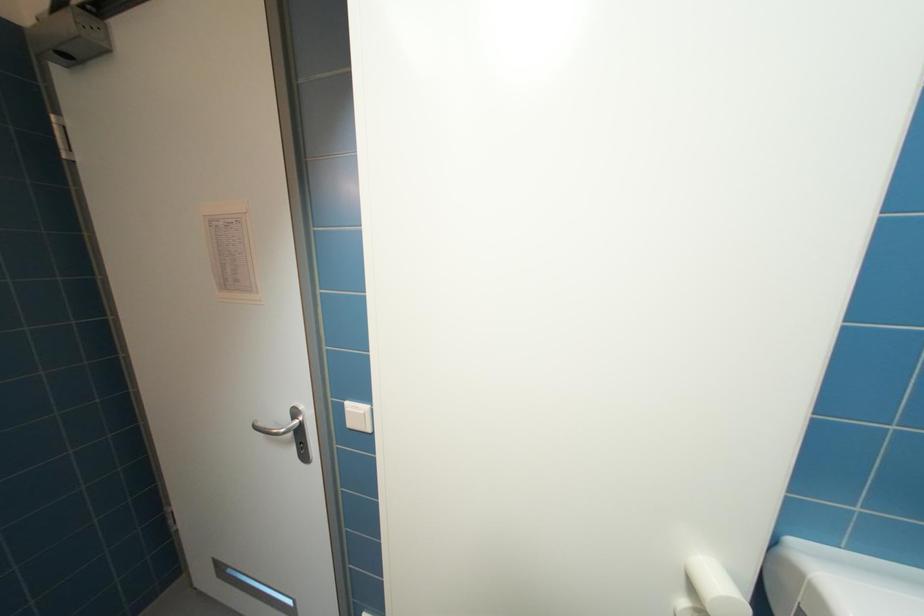
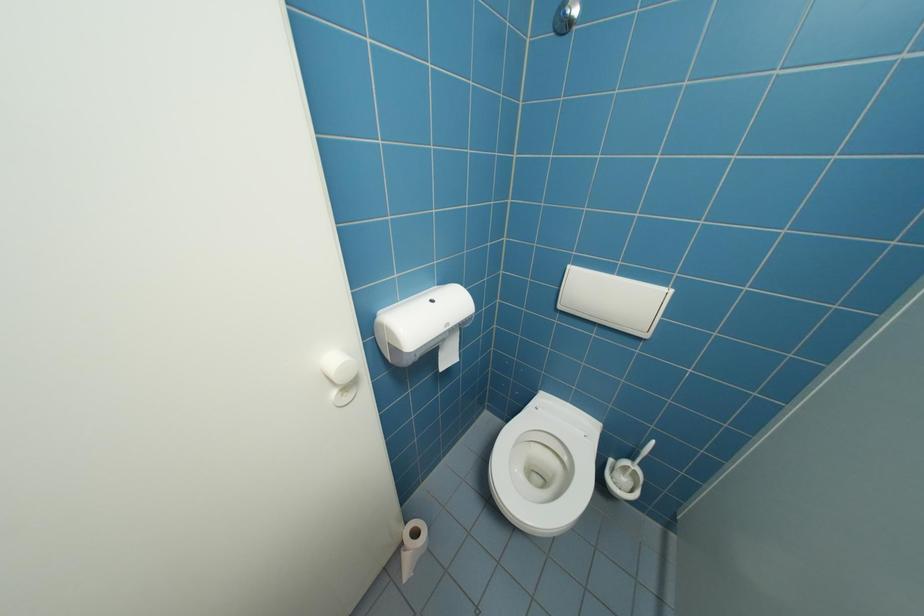
The first image is from the beginning of the video and the second image is from the end. How did the camera likely rotate when shooting the video?

The rotation direction of the camera is right-down.